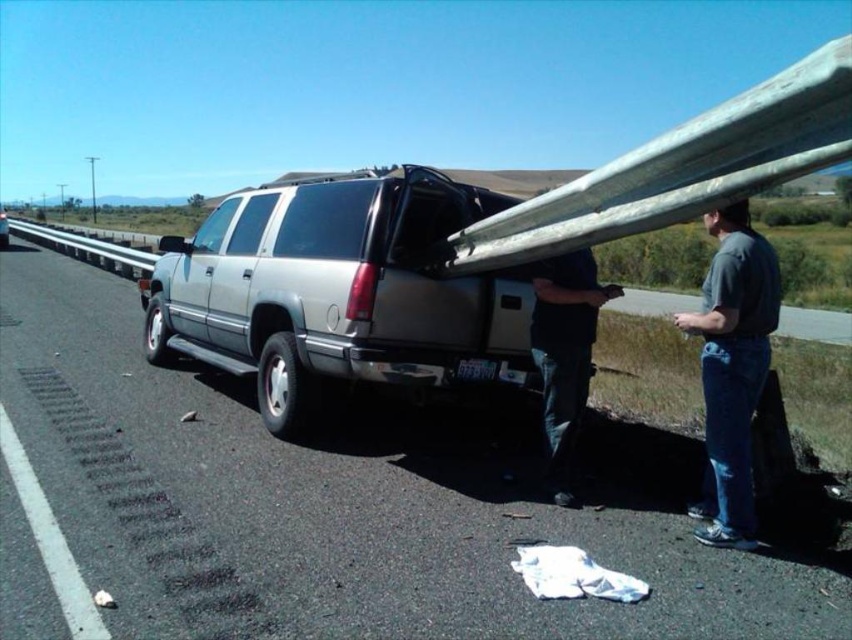
You are a pedestrian standing on the highway and see the brushed metal highway at center and the dark blue jeans at lower center. Which object is closer to your right side?

The dark blue jeans at lower center is on the right side of the brushed metal highway at center, so the dark blue jeans at lower center is closer to your right side.

You are a pedestrian standing at the edge of the highway and see the brushed metal highway at center and the gray cotton shirt at right. Which object is nearer to you?

The brushed metal highway at center is closer to the viewer than the gray cotton shirt at right.

You are a pedestrian standing at the edge of the highway and see the gray cotton shirt at right and dark blue jeans at lower center. Which one is higher up?

The gray cotton shirt at right is taller than dark blue jeans at lower center.